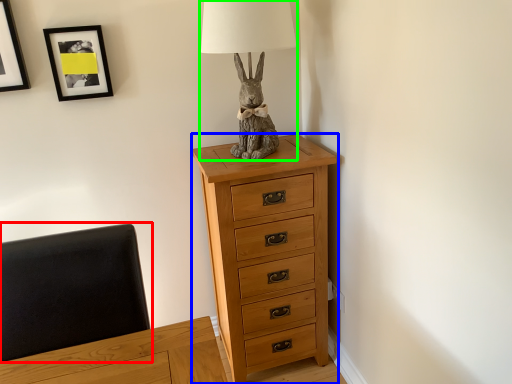
Question: Which is nearer to the swivel chair (highlighted by a red box)? chest of drawers (highlighted by a blue box) or table lamp (highlighted by a green box).

Choices:
 (A) chest of drawers
 (B) table lamp

Answer: (A)